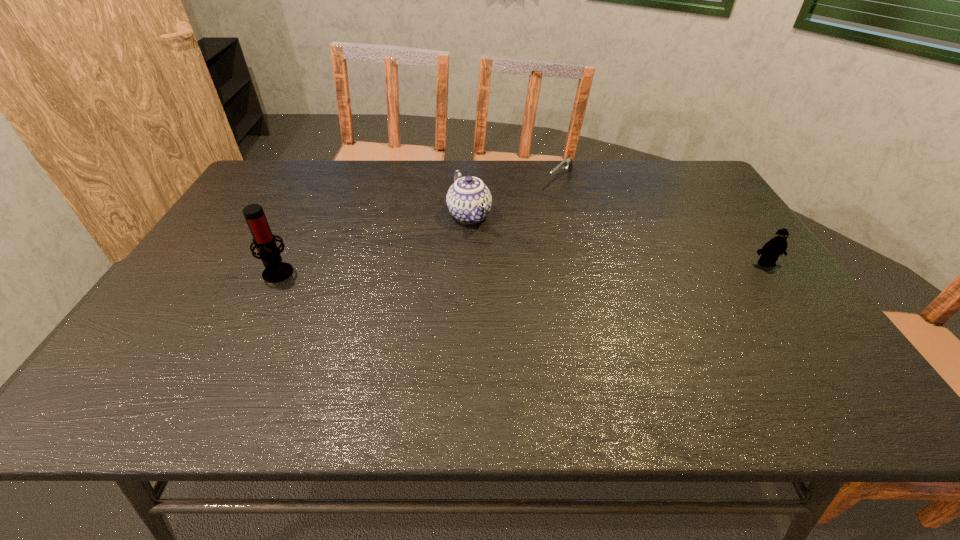
The image size is (960, 540). Find the location of `free space located 0.210m from the spout of the third object from right to left`. free space located 0.210m from the spout of the third object from right to left is located at coordinates (506, 282).

At what (x,y) coordinates should I click in order to perform the action: click on free region located 0.220m from the spout of the third object from right to left. Please return your answer as a coordinate pair (x, y). This screenshot has height=540, width=960. Looking at the image, I should click on (508, 284).

The image size is (960, 540). I want to click on vacant space positioned 0.110m from the spout of the third object from right to left, so click(x=492, y=258).

The width and height of the screenshot is (960, 540). I want to click on vacant space situated 0.080m on the front-facing side of the farthest object, so click(x=542, y=199).

Where is `free point located 0.330m on the front-facing side of the farthest object`? free point located 0.330m on the front-facing side of the farthest object is located at coordinates click(x=499, y=239).

I want to click on vacant point located on the front-facing side of the farthest object, so click(542, 199).

Find the location of a particular element. The image size is (960, 540). chinaware that is at the far edge is located at coordinates (469, 200).

At what (x,y) coordinates should I click in order to perform the action: click on pistol present at the far edge. Please return your answer as a coordinate pair (x, y). Image resolution: width=960 pixels, height=540 pixels. Looking at the image, I should click on (567, 162).

Locate an element on the screen. object that is at the right edge is located at coordinates (770, 252).

Image resolution: width=960 pixels, height=540 pixels. Identify the location of free point at the far edge. (507, 195).